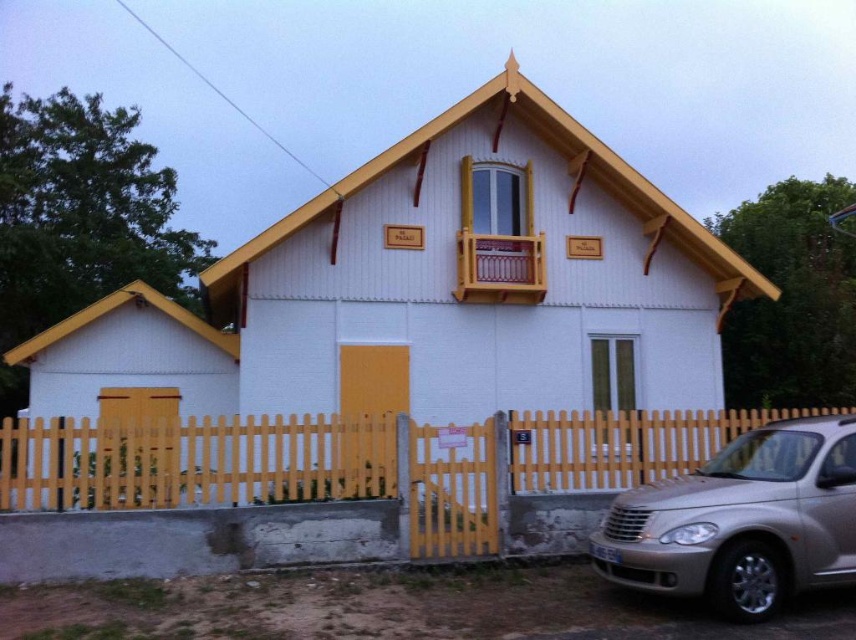
Question: Is yellow wooden fence at lower center further to the viewer compared to silver metallic car at lower right?

Choices:
 (A) no
 (B) yes

Answer: (B)

Question: Does yellow wooden fence at lower center have a lesser width compared to silver metallic car at lower right?

Choices:
 (A) no
 (B) yes

Answer: (B)

Question: Which object appears farthest from the camera in this image?

Choices:
 (A) silver metallic car at lower right
 (B) yellow wooden fence at lower center

Answer: (B)

Question: Can you confirm if yellow wooden fence at lower center is positioned to the left of silver metallic car at lower right?

Choices:
 (A) yes
 (B) no

Answer: (A)

Question: Which of the following is the farthest from the observer?

Choices:
 (A) silver metallic car at lower right
 (B) yellow wooden fence at lower center

Answer: (B)